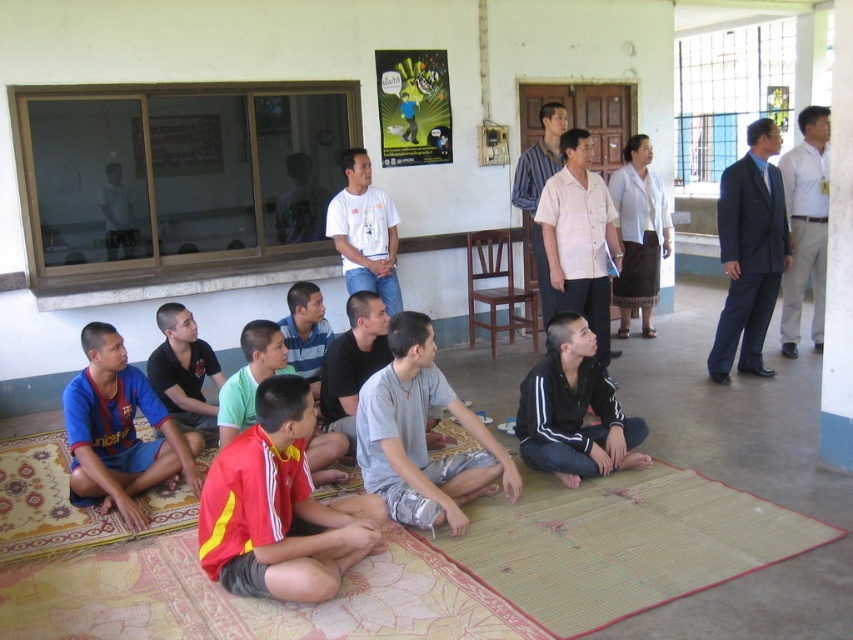
Consider the image. You are standing at point (88, 536) and want to move to point (421, 547). Is the path directly ahead of you clear?

Yes, the path is clear because point (421, 547) is in front of point (88, 536), indicating no obstruction between them.